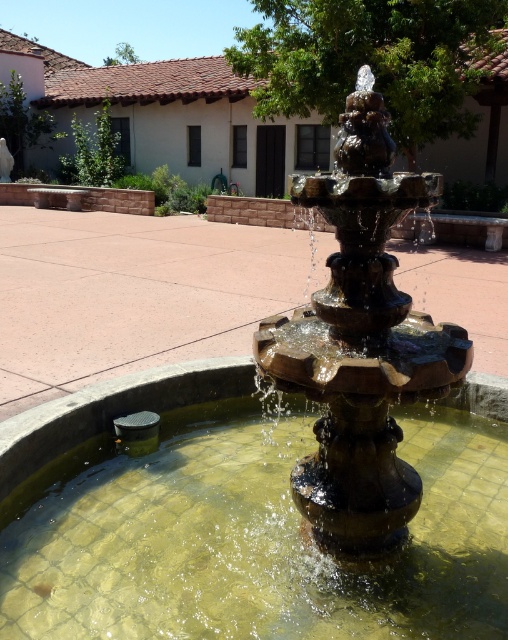
You are standing in front of the brown stone fountain at center and want to take a photo of it. If your camera can focus on objects up to 2 meters away, will it be able to capture the fountain clearly?

The brown stone fountain at center is 1.75 meters away from camera, so yes, the camera can focus on it clearly since it is within the 2 meters range.

You are an architect designing a new plaza and want to place the brown stone fountain at center and bronze fountain at center in such a way that they are both visible from the entrance. Given their sizes, which fountain should be placed closer to the entrance to ensure both are visible without obstruction?

The brown stone fountain at center is thinner than the bronze fountain at center, so placing the thinner brown stone fountain at center closer to the entrance will allow both to be visible without obstruction.

You are standing at the entrance of the building in the background and want to walk directly to the brown stone fountain at center. Which direction should you head towards?

The brown stone fountain at center is located at point (244, 524), so you should head towards the center of the image to reach it.